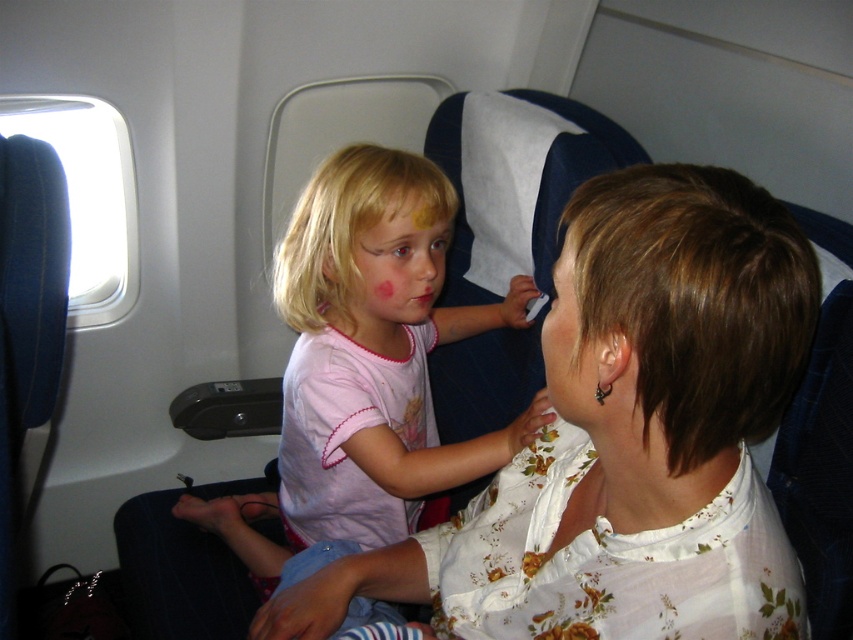
Between pink fabric shirt at center and light pink fabric face at center, which one has more height?

Standing taller between the two is pink fabric shirt at center.

Describe the element at coordinates (366, 364) in the screenshot. I see `pink fabric shirt at center` at that location.

Which is in front, point (503, 461) or point (352, 316)?

Point (503, 461) is more forward.

This screenshot has width=853, height=640. I want to click on pink fabric shirt at center, so click(x=366, y=364).

Does white floral blouse at center have a lesser height compared to light pink fabric face at center?

Incorrect, white floral blouse at center's height does not fall short of light pink fabric face at center's.

Is white floral blouse at center below light pink fabric face at center?

Correct, white floral blouse at center is located below light pink fabric face at center.

Between point (462, 612) and point (376, 349), which one is positioned in front?

Point (462, 612) is more forward.

Where is `white floral blouse at center`? This screenshot has width=853, height=640. white floral blouse at center is located at coordinates (630, 444).

Who is higher up, pink fabric shirt at center or matte white ear at center?

matte white ear at center is higher up.

Can you confirm if pink fabric shirt at center is positioned below matte white ear at center?

Yes, pink fabric shirt at center is below matte white ear at center.

The width and height of the screenshot is (853, 640). Describe the element at coordinates (366, 364) in the screenshot. I see `pink fabric shirt at center` at that location.

Image resolution: width=853 pixels, height=640 pixels. I want to click on pink fabric shirt at center, so click(366, 364).